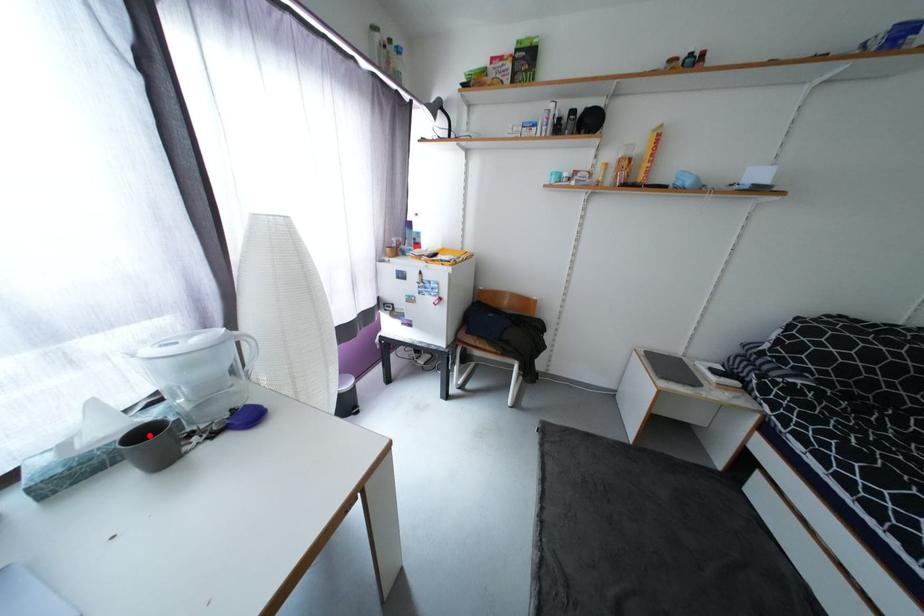
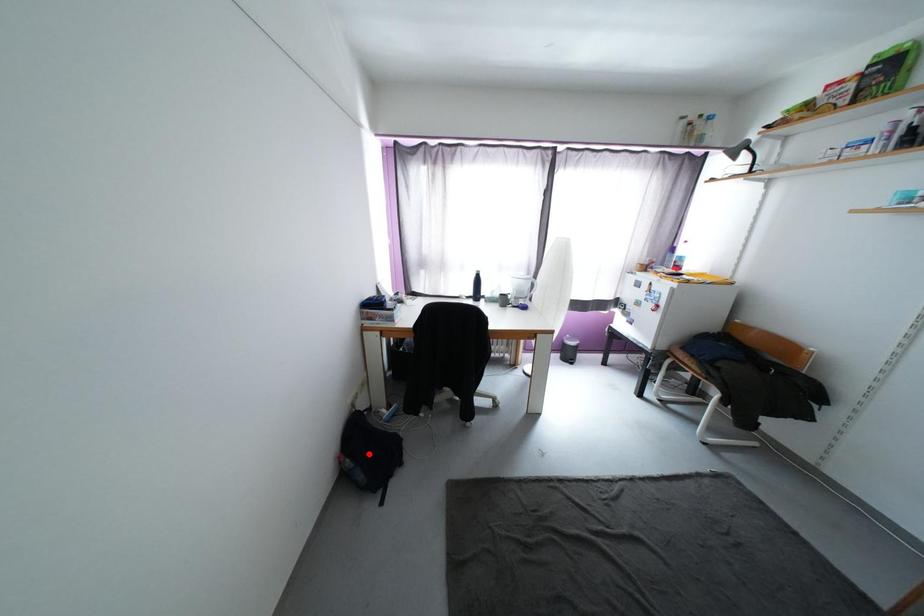
I am providing you with two images of the same scene from different viewpoints. A red point is marked on the first image and another point is marked on the second image. Is the marked point in image1 the same physical position as the marked point in image2?

Result: No